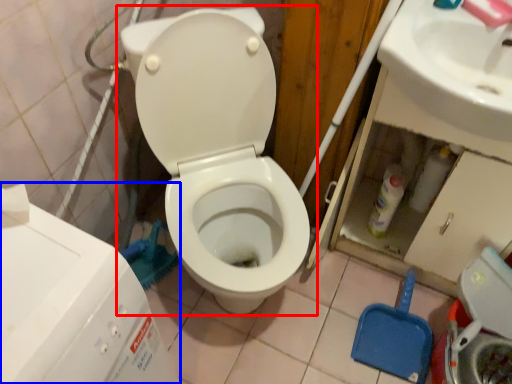
Question: Which object appears farthest to the camera in this image, toilet (highlighted by a red box) or water tank (highlighted by a blue box)?

Choices:
 (A) toilet
 (B) water tank

Answer: (A)